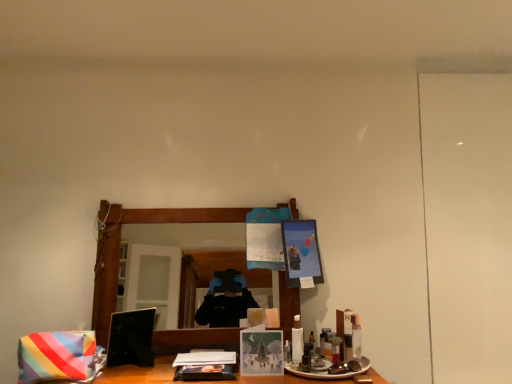
Question: Which direction should I rotate to look at matte paper card at center, arranged as the second picture frame when viewed from the top, — up or down?

Choices:
 (A) down
 (B) up

Answer: (A)

Question: Does matte black picture frame at upper center, positioned as the second picture frame in left-to-right order, have a larger size compared to rainbow striped fabric at lower left?

Choices:
 (A) no
 (B) yes

Answer: (B)

Question: Is matte black picture frame at upper center, acting as the 1th picture frame starting from the top, facing away from rainbow striped fabric at lower left?

Choices:
 (A) no
 (B) yes

Answer: (A)

Question: Does matte black picture frame at upper center, positioned as the second picture frame in left-to-right order, touch rainbow striped fabric at lower left?

Choices:
 (A) no
 (B) yes

Answer: (A)

Question: Is matte black picture frame at upper center, acting as the 1th picture frame starting from the top, outside of rainbow striped fabric at lower left?

Choices:
 (A) no
 (B) yes

Answer: (B)

Question: Can you confirm if matte black picture frame at upper center, which is counted as the 2th picture frame, starting from the bottom, is thinner than rainbow striped fabric at lower left?

Choices:
 (A) no
 (B) yes

Answer: (B)

Question: Is matte black picture frame at upper center, the second picture frame positioned from the front, at the left side of rainbow striped fabric at lower left?

Choices:
 (A) yes
 (B) no

Answer: (B)

Question: From the image's perspective, would you say rainbow striped fabric at lower left is shown under wooden mirror at center?

Choices:
 (A) yes
 (B) no

Answer: (A)

Question: Is rainbow striped fabric at lower left far away from wooden mirror at center?

Choices:
 (A) yes
 (B) no

Answer: (B)

Question: From a real-world perspective, is rainbow striped fabric at lower left over wooden mirror at center?

Choices:
 (A) yes
 (B) no

Answer: (B)

Question: Is rainbow striped fabric at lower left further to camera compared to wooden mirror at center?

Choices:
 (A) yes
 (B) no

Answer: (B)

Question: From a real-world perspective, does rainbow striped fabric at lower left sit lower than wooden mirror at center?

Choices:
 (A) no
 (B) yes

Answer: (B)

Question: Does rainbow striped fabric at lower left appear on the right side of wooden mirror at center?

Choices:
 (A) yes
 (B) no

Answer: (B)

Question: Is white plastic bottle at center, the 2th toiletry positioned from the right, placed right next to matte black picture frame at upper center, the first picture frame positioned from the right?

Choices:
 (A) yes
 (B) no

Answer: (B)